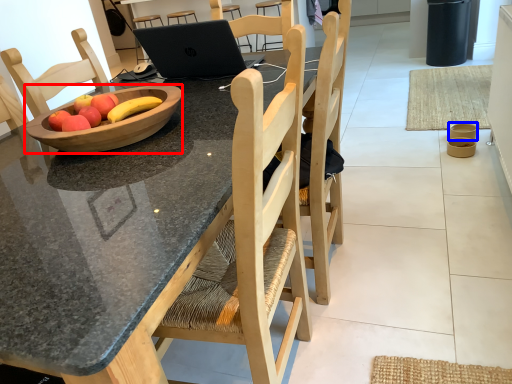
Question: Which object appears farthest to the camera in this image, bowl (highlighted by a red box) or bowl (highlighted by a blue box)?

Choices:
 (A) bowl
 (B) bowl

Answer: (B)